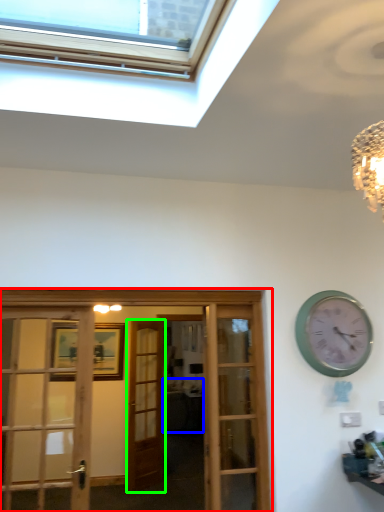
Question: Based on their relative distances, which object is farther from hotel lobby (highlighted by a red box)? Choose from studio couch (highlighted by a blue box) and door (highlighted by a green box).

Choices:
 (A) studio couch
 (B) door

Answer: (A)